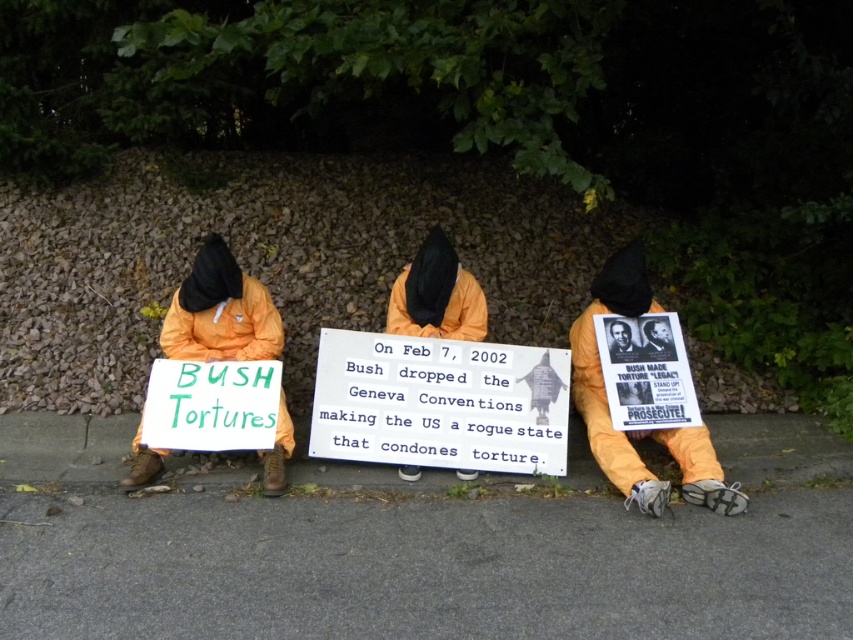
What is located at the coordinates point (637, 429)?

The orange fabric poster at center is located at point (637, 429).

You are a photographer trying to capture a clear shot of the orange fabric poster at center and the orange fabric sign at left. Given their sizes, which one will appear larger in your photo?

The orange fabric poster at center will appear larger in the photo because it is much taller than the orange fabric sign at left.

You are a photographer standing at the center of the scene. You want to take a photo that includes both the point at position (697,456) and the point at (421,289). Which point should be closer to the camera to ensure both are in focus?

Point (697,456) is in front of point (421,289), so to ensure both are in focus, the photographer should position the camera so that the point at (697,456) is closer to the camera.